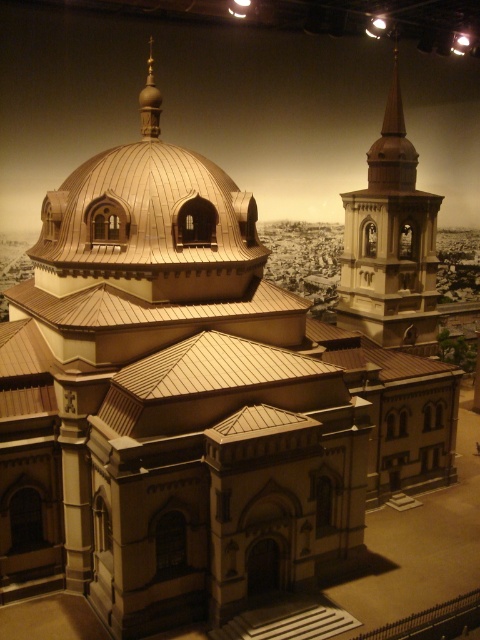
Question: Is gold textured spire at upper right in front of gold polished dome at upper center?

Choices:
 (A) no
 (B) yes

Answer: (A)

Question: Which point appears farthest from the camera in this image?

Choices:
 (A) (158, 116)
 (B) (384, 180)

Answer: (B)

Question: Which point is closer to the camera?

Choices:
 (A) (397, 189)
 (B) (145, 125)

Answer: (B)

Question: Is gold textured spire at upper right thinner than gold polished dome at upper center?

Choices:
 (A) yes
 (B) no

Answer: (B)

Question: Is gold textured spire at upper right below gold polished dome at upper center?

Choices:
 (A) no
 (B) yes

Answer: (B)